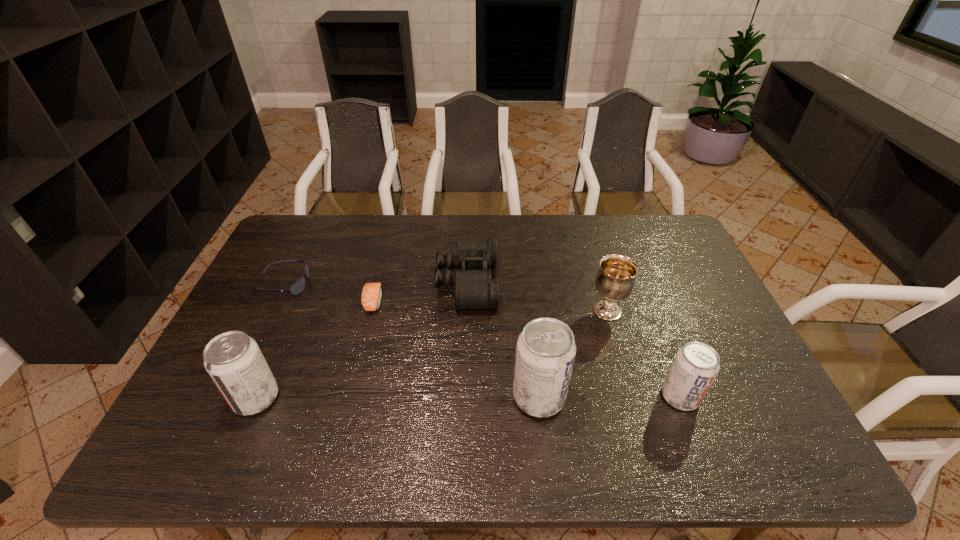
The width and height of the screenshot is (960, 540). What are the coordinates of `free space at the far edge of the desktop` in the screenshot? It's located at (550, 225).

The width and height of the screenshot is (960, 540). I want to click on vacant space at the near edge, so click(x=403, y=414).

In order to click on vacant area at the left edge of the desktop in this screenshot , I will do `click(272, 268)`.

Locate an element on the screen. The width and height of the screenshot is (960, 540). free location at the right edge is located at coordinates (725, 347).

Where is `vacant space at the far left corner of the desktop`? The width and height of the screenshot is (960, 540). vacant space at the far left corner of the desktop is located at coordinates (306, 221).

Where is `vacant space at the far right corner`? The width and height of the screenshot is (960, 540). vacant space at the far right corner is located at coordinates (648, 237).

In order to click on free space between the fifth object from right to left and the sunglasses in this screenshot , I will do `click(328, 293)`.

Locate an element on the screen. unoccupied area between the shortest soda can and the fifth object from left to right is located at coordinates coord(610,396).

Where is `free space between the sunglasses and the second object from right to left`? Image resolution: width=960 pixels, height=540 pixels. free space between the sunglasses and the second object from right to left is located at coordinates (444, 298).

Identify the location of unoccupied area between the binoculars and the sushi. The height and width of the screenshot is (540, 960). tap(420, 292).